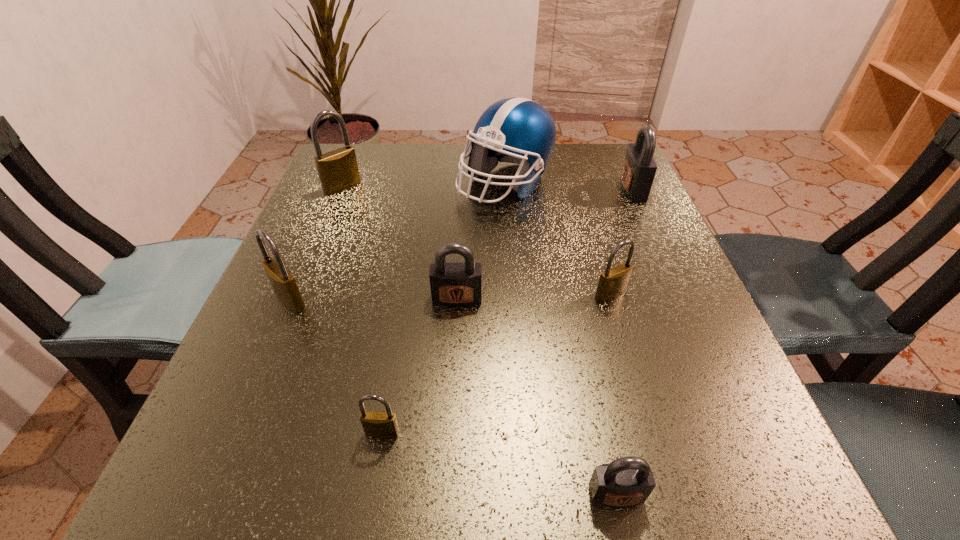
Find the location of a particular element. This screenshot has width=960, height=540. vacant space situated on the left of the second smallest brass padlock is located at coordinates (444, 294).

Locate an element on the screen. free location located on the front of the second biggest gray padlock near the keyhole is located at coordinates (451, 417).

The image size is (960, 540). Find the location of `vacant space located on the right of the sixth object from right to left`. vacant space located on the right of the sixth object from right to left is located at coordinates coord(588,433).

Identify the location of football helmet at the far edge. (516, 130).

Where is `object that is at the near edge`? object that is at the near edge is located at coordinates (627, 481).

You are a GUI agent. You are given a task and a screenshot of the screen. Output one action in this format:
    pyautogui.click(x=<x>, y=<y>)
    Task: Click on the object that is at the far left corner
    Image resolution: width=960 pixels, height=540 pixels.
    Given the screenshot: What is the action you would take?
    pyautogui.click(x=338, y=171)

Locate an element on the screen. This screenshot has width=960, height=540. object that is at the far right corner is located at coordinates (639, 167).

I want to click on free spot at the far edge of the desktop, so click(x=436, y=183).

In the image, there is a desktop. Where is `vacant region at the near edge`? The image size is (960, 540). vacant region at the near edge is located at coordinates (529, 476).

The image size is (960, 540). In the image, there is a desktop. What are the coordinates of `vacant space at the left edge` in the screenshot? It's located at (362, 209).